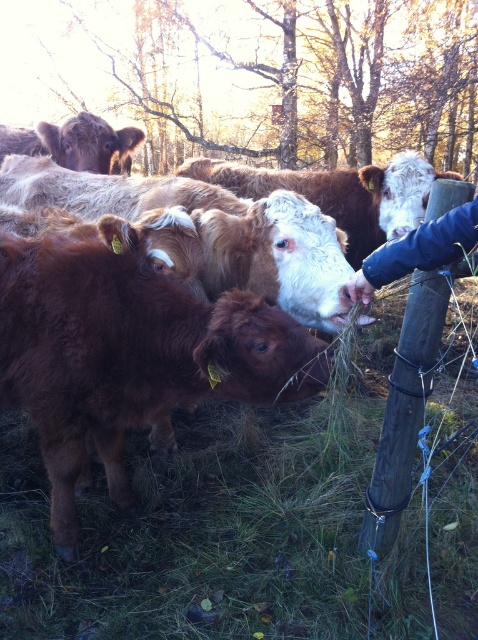
Is brown wooden post at right to the right of brown woolen cow at center from the viewer's perspective?

Correct, you'll find brown wooden post at right to the right of brown woolen cow at center.

Image resolution: width=478 pixels, height=640 pixels. Describe the element at coordinates (411, 348) in the screenshot. I see `brown wooden post at right` at that location.

Who is more forward, (422,250) or (395,179)?

Positioned in front is point (422,250).

The width and height of the screenshot is (478, 640). Find the location of `brown wooden post at right`. brown wooden post at right is located at coordinates (411, 348).

Does brown fuzzy cow at center have a greater height compared to blue fabric sleeve at upper right?

Yes, brown fuzzy cow at center is taller than blue fabric sleeve at upper right.

Is point (151, 179) farther from camera compared to point (437, 253)?

That is True.

Is point (26, 177) behind point (434, 225)?

Yes, point (26, 177) is farther from viewer.

This screenshot has width=478, height=640. I want to click on brown fuzzy cow at center, so click(213, 230).

Which is in front, point (308, 301) or point (119, 168)?

Positioned in front is point (308, 301).

Is brown fuzzy cow at center bigger than brown woolen cow at upper left?

Correct, brown fuzzy cow at center is larger in size than brown woolen cow at upper left.

Image resolution: width=478 pixels, height=640 pixels. What are the coordinates of `brown fuzzy cow at center` in the screenshot? It's located at (213, 230).